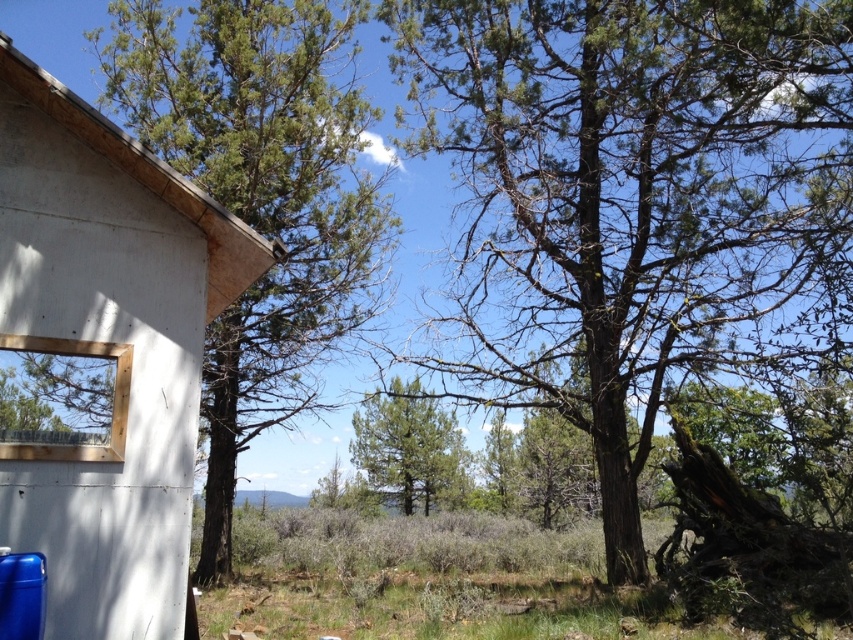
Question: Does green needle-like at left appear on the right side of green leafy tree at center?

Choices:
 (A) no
 (B) yes

Answer: (A)

Question: Is green rough bark tree at center further to the viewer compared to green needle-like at left?

Choices:
 (A) no
 (B) yes

Answer: (A)

Question: Which of the following is the farthest from the observer?

Choices:
 (A) green rough bark tree at center
 (B) green leafy tree at center
 (C) green needle-like at left
 (D) white concrete hut at left

Answer: (B)

Question: Which point is closer to the camera?

Choices:
 (A) (183, 113)
 (B) (451, 442)
 (C) (757, 248)

Answer: (C)

Question: Which of the following is the farthest from the observer?

Choices:
 (A) green needle-like at left
 (B) white concrete hut at left
 (C) green leafy tree at center

Answer: (C)

Question: Can you confirm if white concrete hut at left is positioned to the left of green leafy tree at center?

Choices:
 (A) yes
 (B) no

Answer: (A)